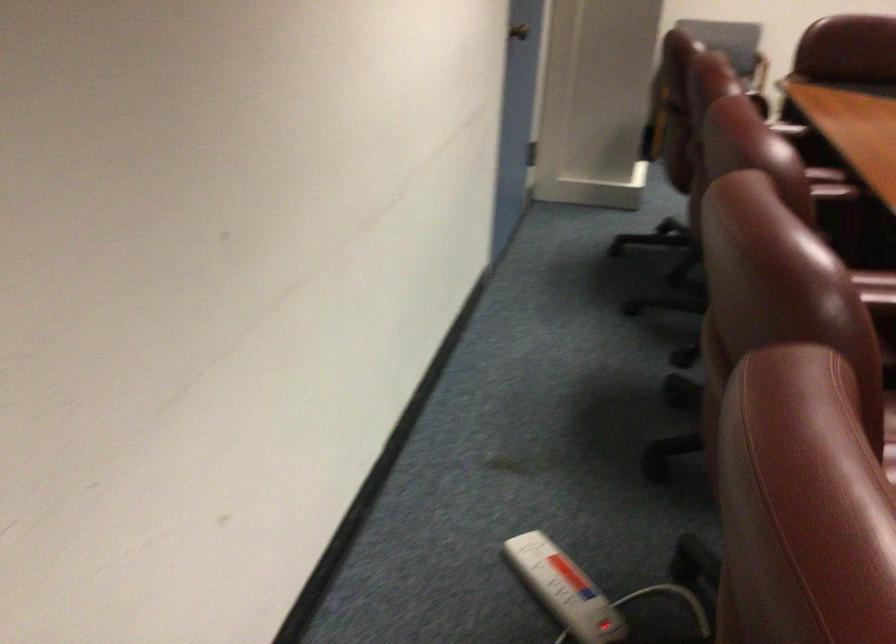
The image size is (896, 644). Identify the location of white power strip. (564, 589).